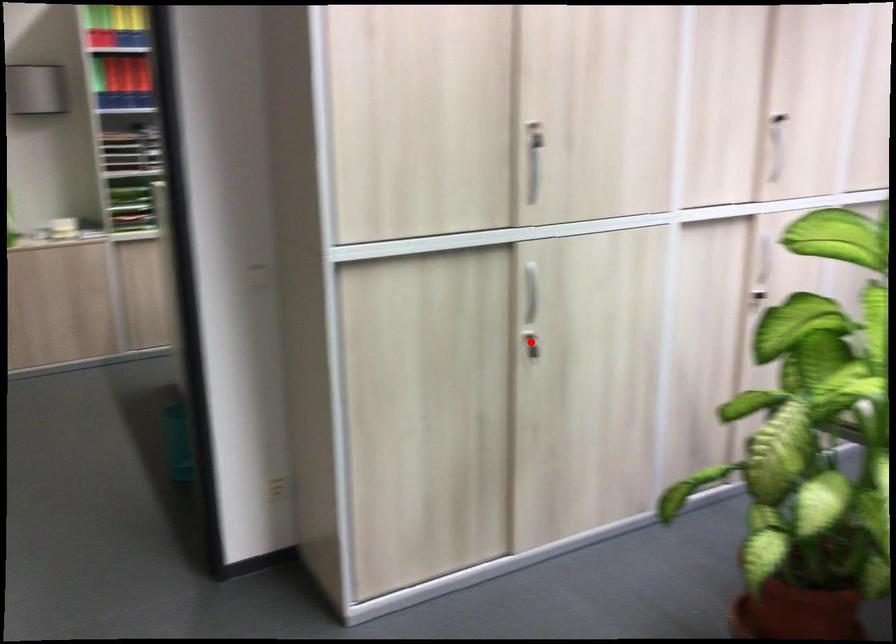
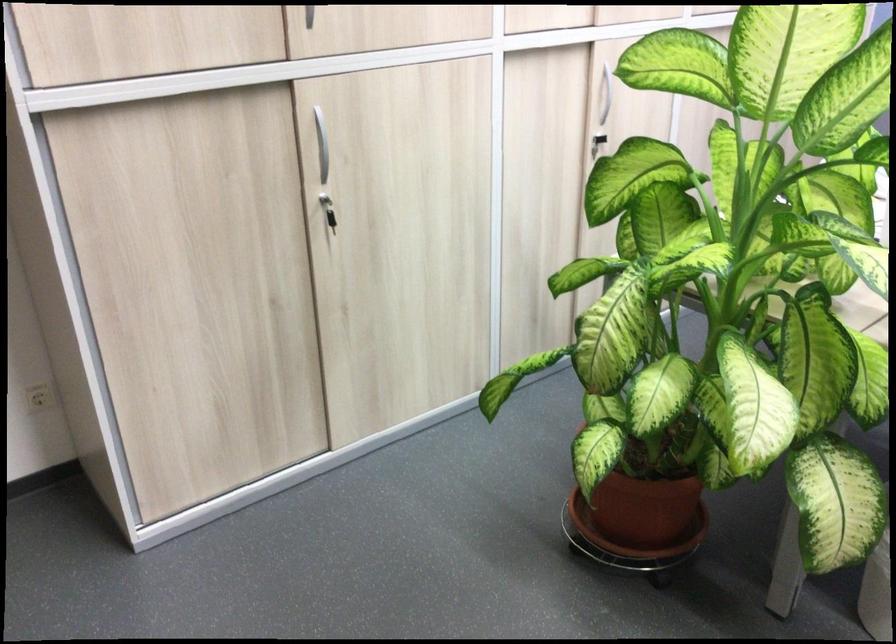
Question: I am providing you with two images of the same scene from different viewpoints. Given a red point in image1, look at the same physical point in image2. Is it:

Choices:
 (A) Closer to the viewpoint
 (B) Farther from the viewpoint

Answer: (A)